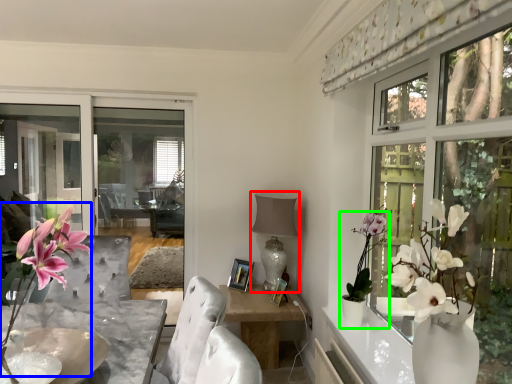
Question: Which is nearer to the lamp (highlighted by a red box)? floral arrangement (highlighted by a blue box) or houseplant (highlighted by a green box).

Choices:
 (A) floral arrangement
 (B) houseplant

Answer: (B)